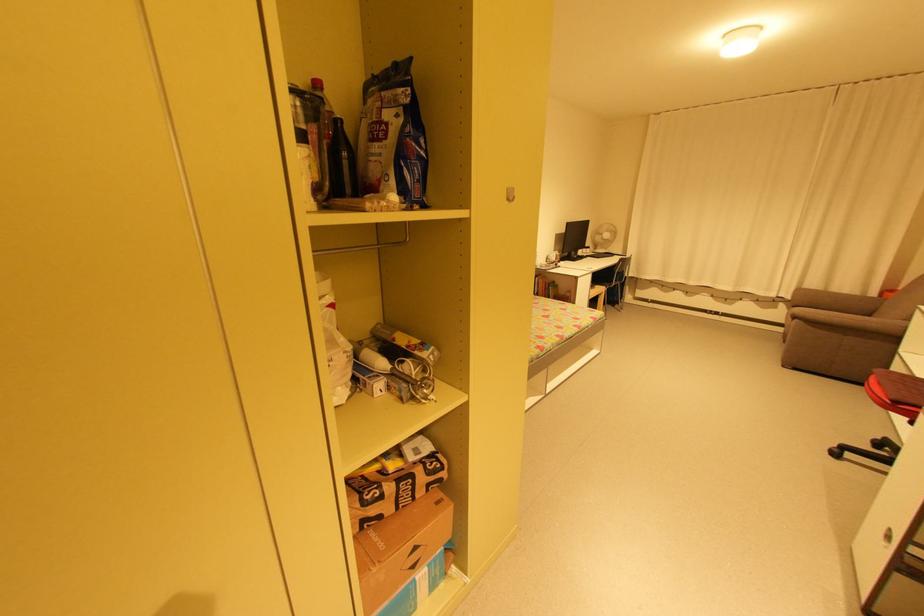
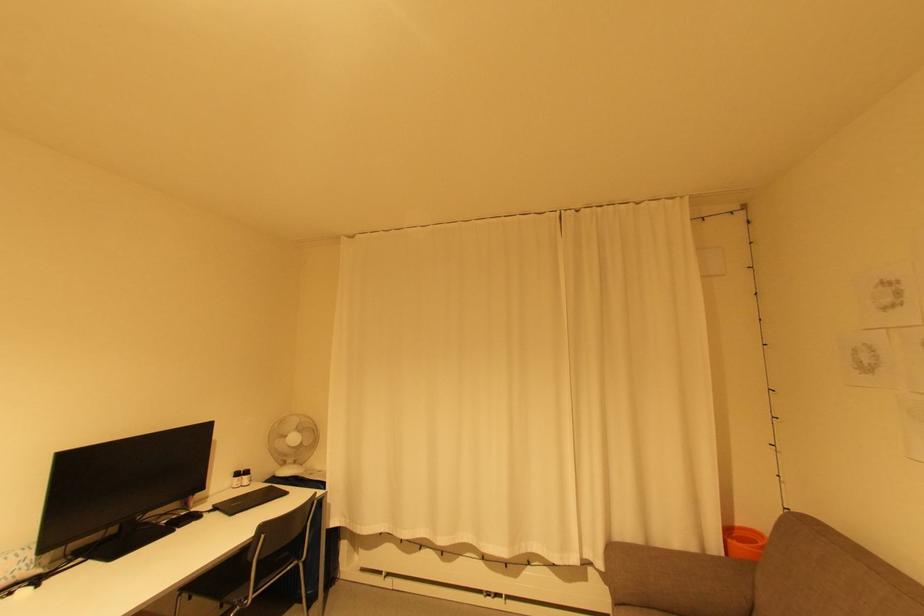
In the second image, find the point that corresponds to pixel 894 291 in the first image.

(733, 533)